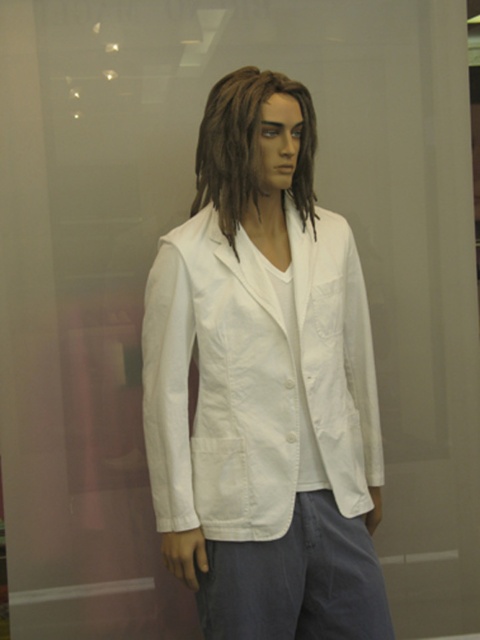
Is white cotton lab coat at center below brownhair at center?

Yes.

Does white cotton lab coat at center appear on the right side of brownhair at center?

Indeed, white cotton lab coat at center is positioned on the right side of brownhair at center.

The image size is (480, 640). What do you see at coordinates (264, 385) in the screenshot?
I see `white cotton lab coat at center` at bounding box center [264, 385].

What are the coordinates of `white cotton lab coat at center` in the screenshot? It's located at pos(264,385).

Which is more to the right, denim pants at lower center or brownhair at center?

denim pants at lower center

Does denim pants at lower center appear over brownhair at center?

Incorrect, denim pants at lower center is not positioned above brownhair at center.

Identify the location of denim pants at lower center. (297, 580).

Is white cotton lab coat at center above denim pants at lower center?

Yes.

In the scene shown: Does white cotton lab coat at center have a smaller size compared to denim pants at lower center?

No.

Between point (200, 208) and point (206, 604), which one is positioned behind?

Positioned behind is point (200, 208).

Image resolution: width=480 pixels, height=640 pixels. I want to click on white cotton lab coat at center, so click(264, 385).